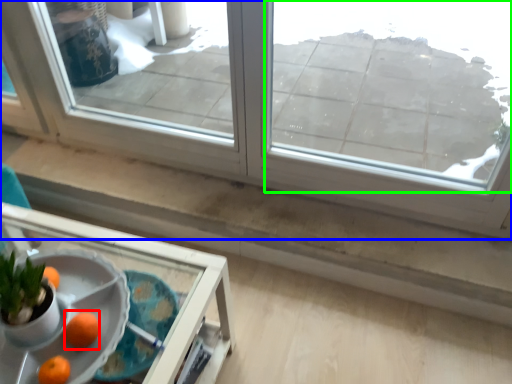
Question: Considering the real-world distances, which object is farthest from orange (highlighted by a red box)? window (highlighted by a blue box) or window (highlighted by a green box)?

Choices:
 (A) window
 (B) window

Answer: (B)